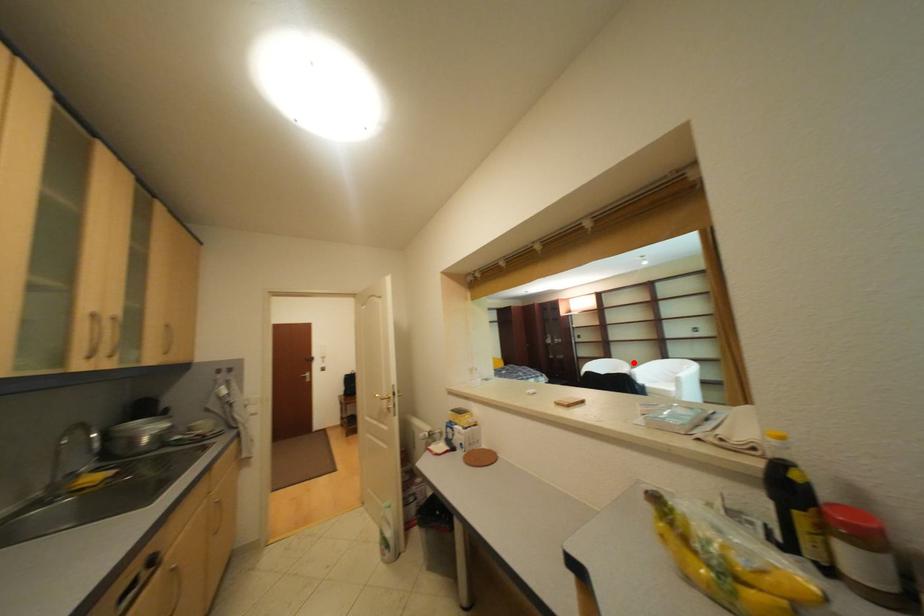
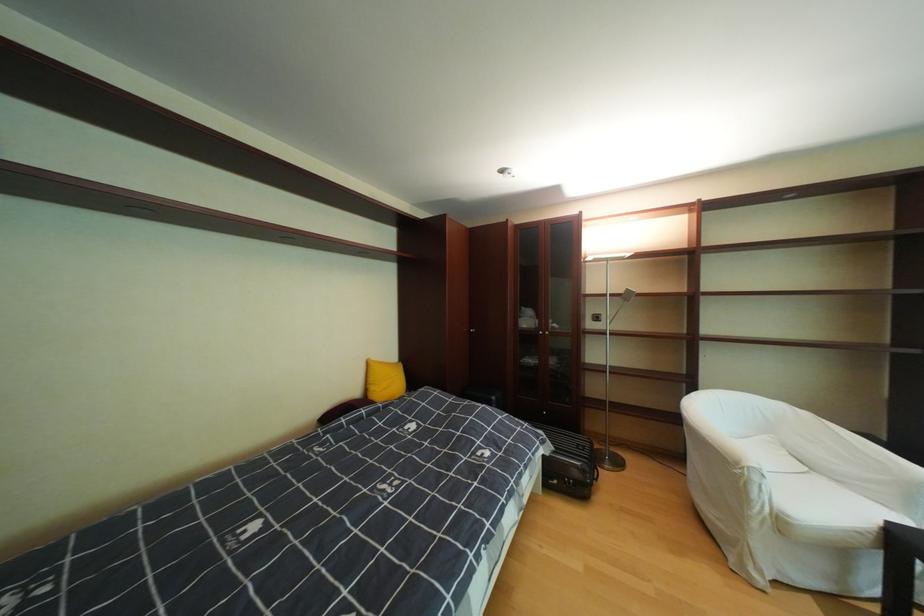
Question: I am providing you with two images of the same scene from different viewpoints. Given a red point in image1, look at the same physical point in image2. Is it:

Choices:
 (A) Closer to the viewpoint
 (B) Farther from the viewpoint

Answer: (A)